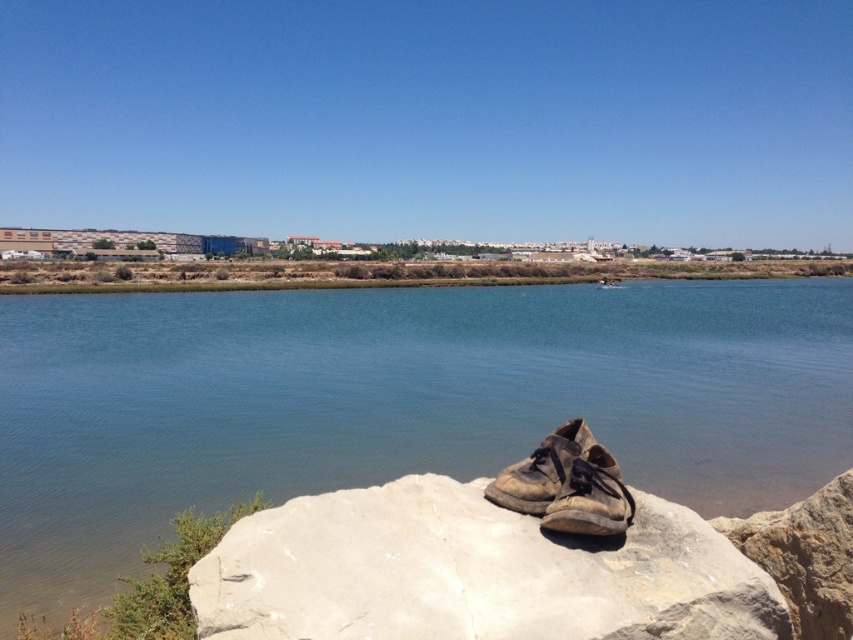
You are standing at the point with coordinates 0.5, 0.5 in this riverside scene. You want to walk to the blue water at center. Which direction should you move in?

The blue water at center is located at coordinates (393, 401). Since your current position is (426, 320), you should move to the right and slightly downward to reach it.

You are standing at the point labeled point [675,496] in the riverside scene. If you want to walk 15 meters straight towards the direction you are facing, will you reach the opposite riverbank?

The distance between you and the viewer is 10.15 meters. Since you want to walk 15 meters, which is farther than the distance to the viewer, you would surpass the current viewpoint but the question about reaching the opposite riverbank depends on the river width. However, the provided information only specifies the distance to the viewer, not the river width. Thus, it cannot be determined from the given data.